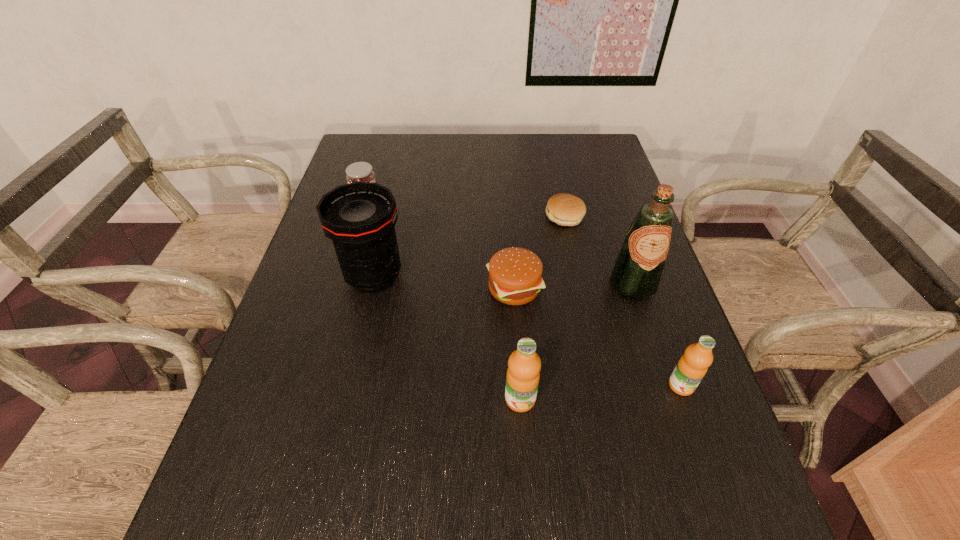
Identify the location of vacant region located 0.090m on the label of the left orange juice. This screenshot has width=960, height=540. (524, 461).

Where is `vacant space located on the label of the right orange juice`? The image size is (960, 540). vacant space located on the label of the right orange juice is located at coordinates (699, 436).

Identify the location of vacant region located on the front of the jam. The image size is (960, 540). (349, 256).

Image resolution: width=960 pixels, height=540 pixels. I want to click on free space located 0.230m on the front-facing side of the tallest object, so click(x=667, y=391).

The height and width of the screenshot is (540, 960). Identify the location of vacant space located on the right of the shortest object. (626, 216).

Image resolution: width=960 pixels, height=540 pixels. What are the coordinates of `free location located on the back of the second tallest object` in the screenshot? It's located at (382, 239).

You are a GUI agent. You are given a task and a screenshot of the screen. Output one action in this format:
    pyautogui.click(x=<x>, y=<y>)
    Task: Click on the vacant area located on the front of the sixth tallest object
    Image resolution: width=960 pixels, height=540 pixels.
    Given the screenshot: What is the action you would take?
    (520, 378)

Where is `jam positioned at the left edge`? This screenshot has width=960, height=540. jam positioned at the left edge is located at coordinates (360, 171).

This screenshot has height=540, width=960. Identify the location of telephoto lens positioned at the left edge. (360, 217).

Identify the location of orange juice located at the right edge. (691, 368).